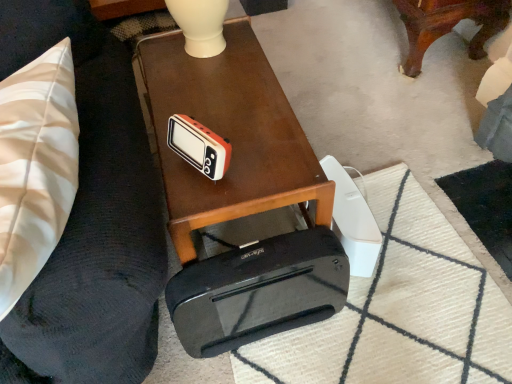
Locate an element on the screen. The height and width of the screenshot is (384, 512). vacant area that is in front of orange matte clock at center is located at coordinates 201,205.